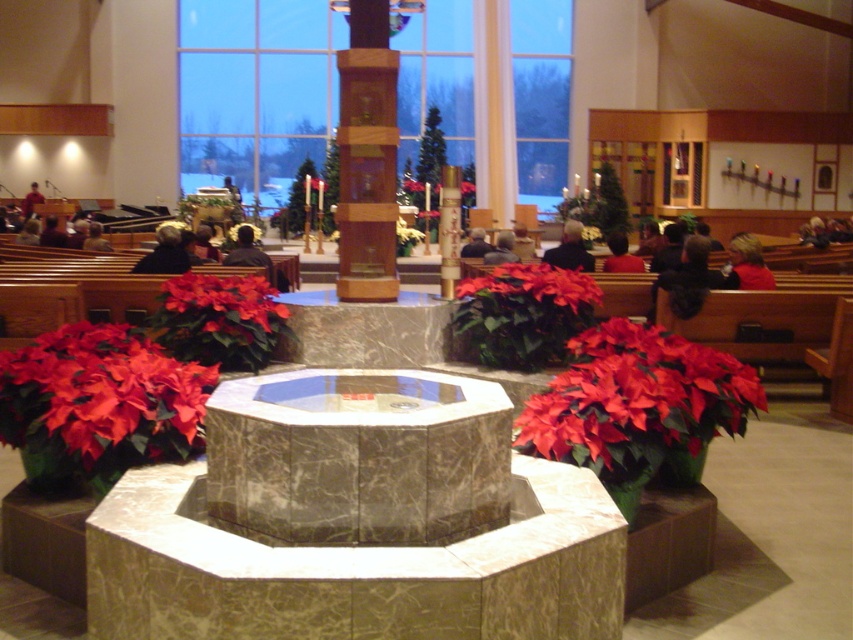
Between matte red poinsettia at lower right and red matte poinsettia at center, which one appears on the left side from the viewer's perspective?

Positioned to the left is red matte poinsettia at center.

Is point (639, 326) positioned behind point (473, 284)?

No, (639, 326) is closer to viewer.

Is point (650, 349) more distant than point (549, 288)?

No, (650, 349) is closer to viewer.

Identify the location of matte red poinsettia at lower right. The image size is (853, 640). (636, 401).

Image resolution: width=853 pixels, height=640 pixels. What are the coordinates of `matte red poinsettia at lower right` in the screenshot? It's located at (636, 401).

Is matte red poinsettia at lower right below matte red poinsettia at center?

Yes.

This screenshot has width=853, height=640. I want to click on matte red poinsettia at lower right, so click(x=636, y=401).

You are a GUI agent. You are given a task and a screenshot of the screen. Output one action in this format:
    pyautogui.click(x=<x>, y=<y>)
    Task: Click on the matte red poinsettia at lower right
    The width and height of the screenshot is (853, 640).
    Given the screenshot: What is the action you would take?
    pyautogui.click(x=636, y=401)

Between matte red poinsettia at lower left and matte red poinsettia at center, which one is positioned higher?

matte red poinsettia at center is higher up.

The image size is (853, 640). I want to click on matte red poinsettia at lower left, so click(x=102, y=397).